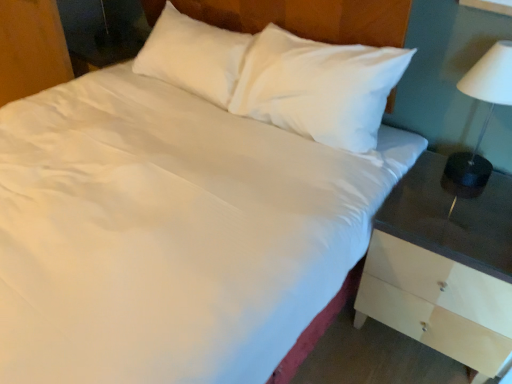
The width and height of the screenshot is (512, 384). I want to click on vacant location below white glossy lampshade at right (from a real-world perspective), so click(460, 173).